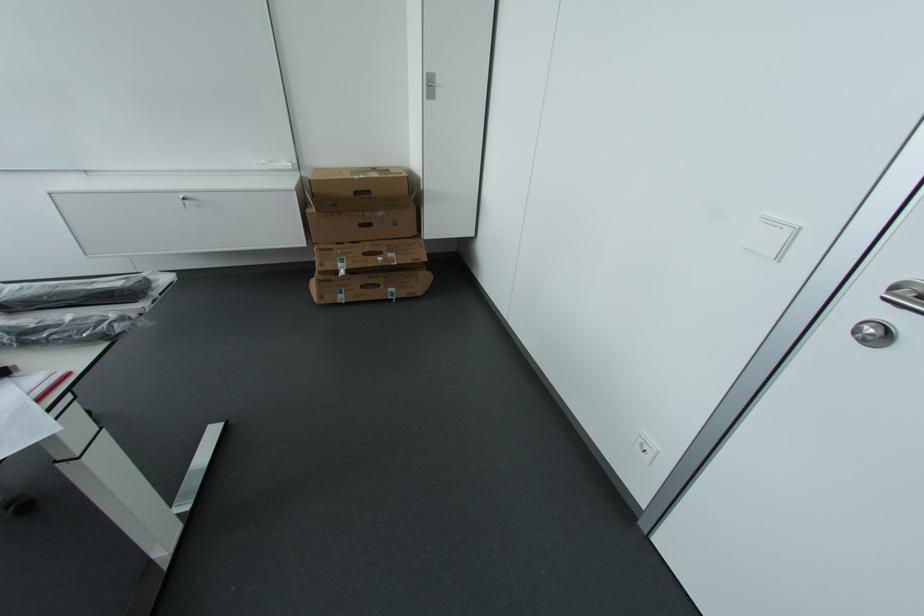
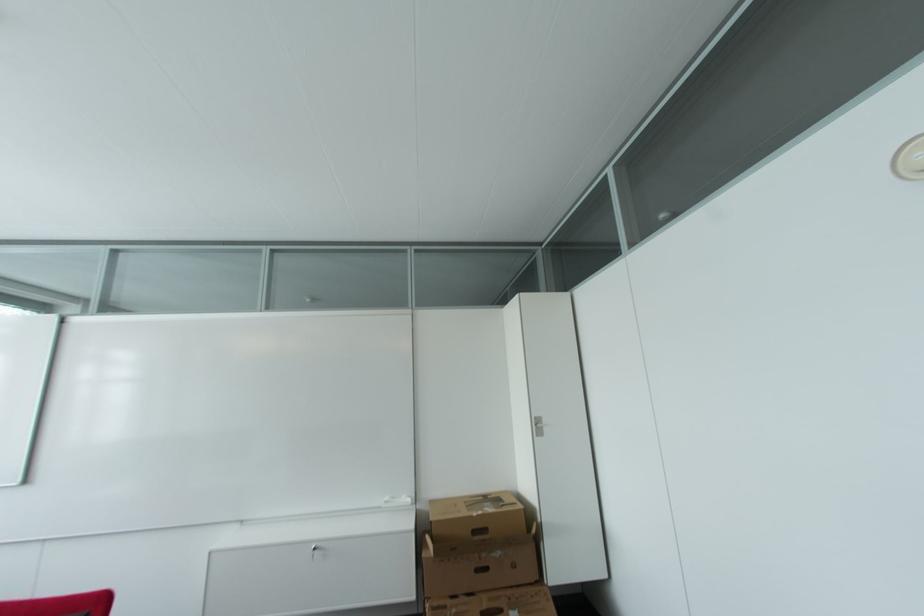
Where in the second image is the point corresponding to (358,180) from the first image?

(476, 517)